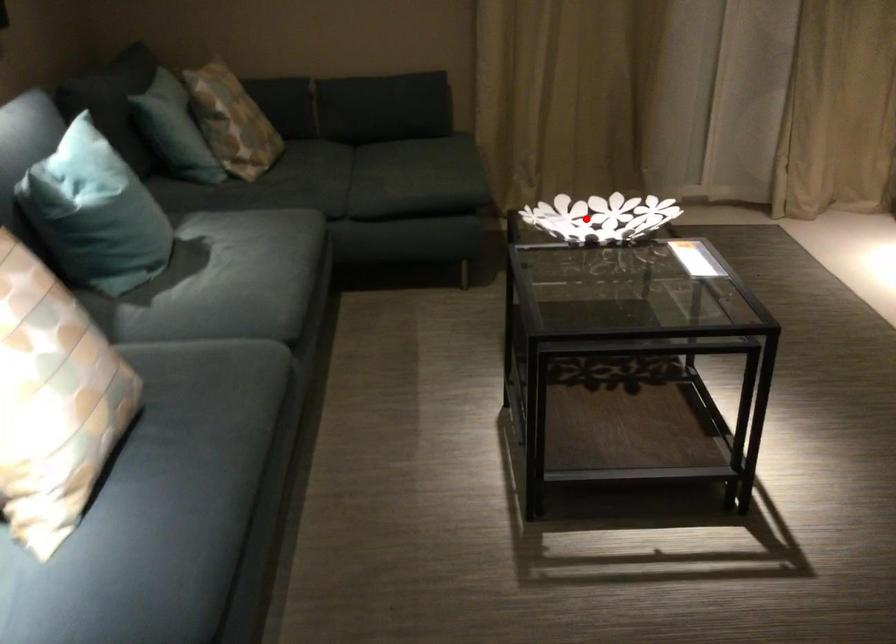
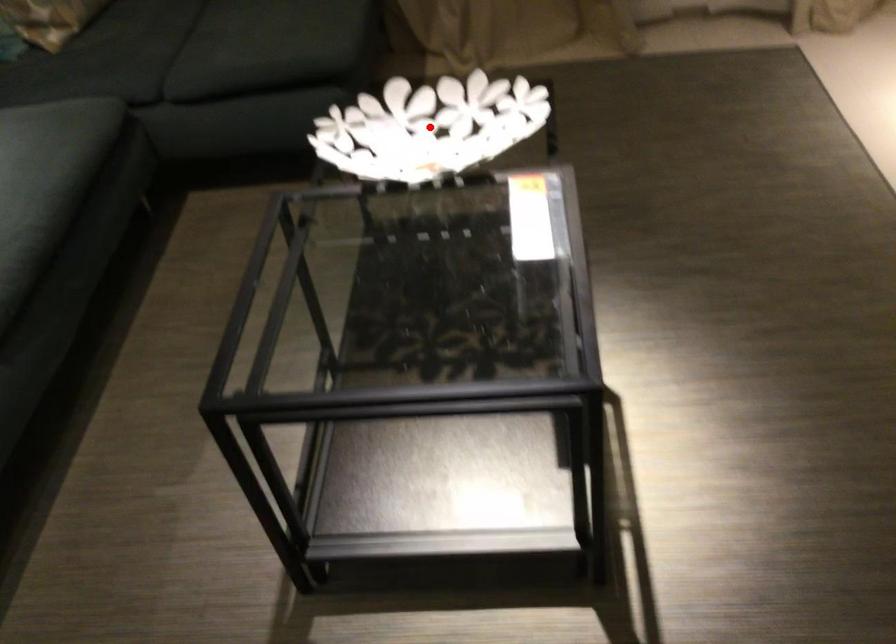
I am providing you with two images of the same scene from different viewpoints. A red point is marked on the first image and another point is marked on the second image. Do the highlighted points in image1 and image2 indicate the same real-world spot?

Yes